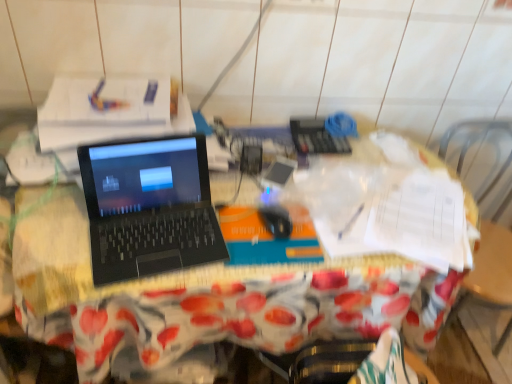
The width and height of the screenshot is (512, 384). Identify the location of vacant point above black plastic laptop at center (from a real-world perspective). (297, 206).